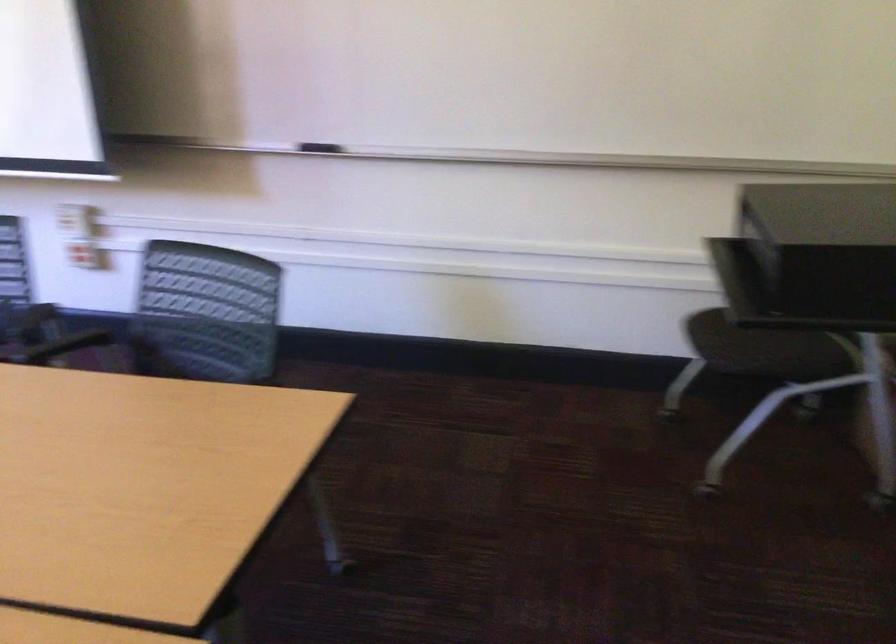
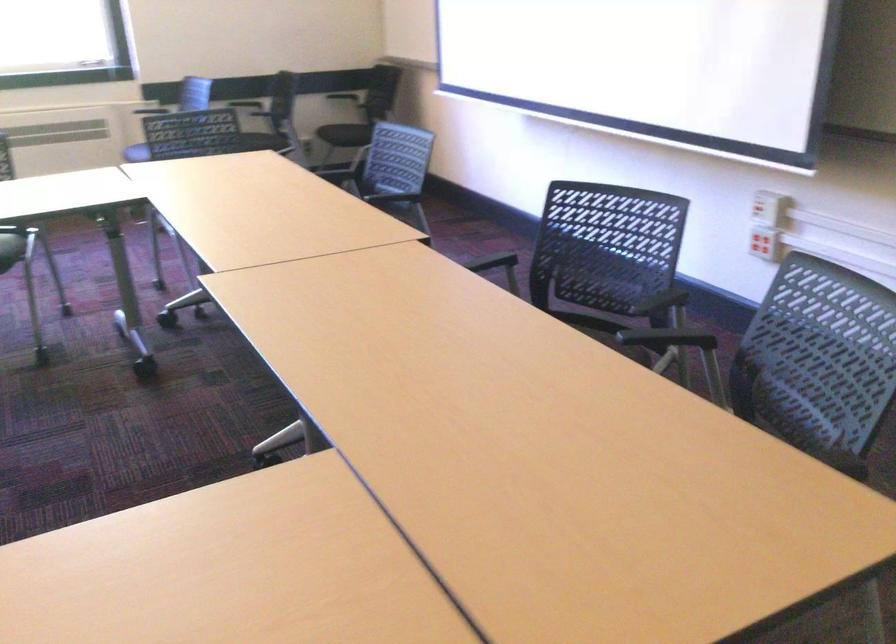
Question: How did the camera likely rotate?

Choices:
 (A) Left
 (B) Right
 (C) Up
 (D) Down

Answer: (A)